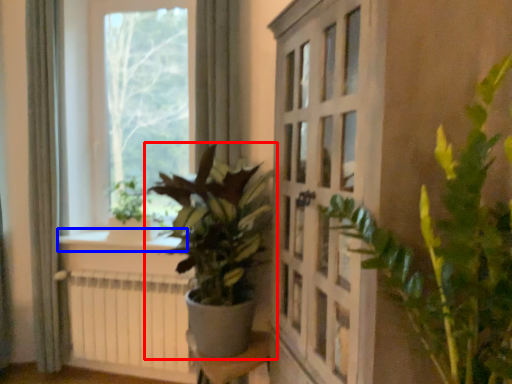
Question: Which object is closer to the camera taking this photo, houseplant (highlighted by a red box) or window sill (highlighted by a blue box)?

Choices:
 (A) houseplant
 (B) window sill

Answer: (A)